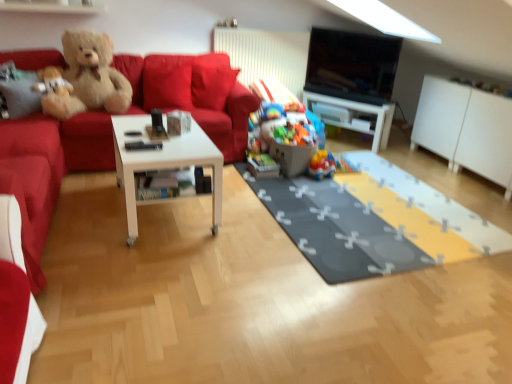
The width and height of the screenshot is (512, 384). I want to click on free spot in front of white glossy coffee table at center, so click(151, 265).